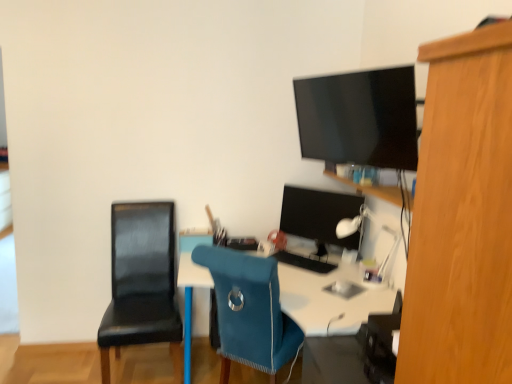
Question: Is black leather chair at left, placed as the second chair when sorted from right to left, oriented away from black matte keyboard at center?

Choices:
 (A) no
 (B) yes

Answer: (A)

Question: From a real-world perspective, is black leather chair at left, placed as the second chair when sorted from right to left, on black matte keyboard at center?

Choices:
 (A) yes
 (B) no

Answer: (B)

Question: Does black leather chair at left, acting as the first chair starting from the left, have a lesser height compared to black matte keyboard at center?

Choices:
 (A) yes
 (B) no

Answer: (B)

Question: From the image's perspective, does black leather chair at left, acting as the first chair starting from the left, appear higher than black matte keyboard at center?

Choices:
 (A) yes
 (B) no

Answer: (B)

Question: Can you confirm if black leather chair at left, acting as the first chair starting from the left, is bigger than black matte keyboard at center?

Choices:
 (A) no
 (B) yes

Answer: (B)

Question: Considering the positions of white glossy desk at center and matte black monitor at center in the image, is white glossy desk at center bigger or smaller than matte black monitor at center?

Choices:
 (A) big
 (B) small

Answer: (A)

Question: Is white glossy desk at center spatially inside matte black monitor at center, or outside of it?

Choices:
 (A) inside
 (B) outside

Answer: (B)

Question: Visually, is white glossy desk at center positioned to the left or to the right of matte black monitor at center?

Choices:
 (A) right
 (B) left

Answer: (B)

Question: Is point (354, 299) closer or farther from the camera than point (308, 215)?

Choices:
 (A) farther
 (B) closer

Answer: (B)

Question: Based on their sizes in the image, would you say white plastic lamp at upper right is bigger or smaller than matte black monitor at center?

Choices:
 (A) big
 (B) small

Answer: (B)

Question: Would you say white plastic lamp at upper right is to the left or to the right of matte black monitor at center in the picture?

Choices:
 (A) left
 (B) right

Answer: (B)

Question: From a real-world perspective, relative to matte black monitor at center, is white plastic lamp at upper right vertically above or below?

Choices:
 (A) above
 (B) below

Answer: (B)

Question: Is white plastic lamp at upper right taller or shorter than matte black monitor at center?

Choices:
 (A) tall
 (B) short

Answer: (B)

Question: Relative to black matte keyboard at center, is matte black monitor at center in front or behind?

Choices:
 (A) front
 (B) behind

Answer: (B)

Question: Looking at the image, does matte black monitor at center seem bigger or smaller compared to black matte keyboard at center?

Choices:
 (A) small
 (B) big

Answer: (B)